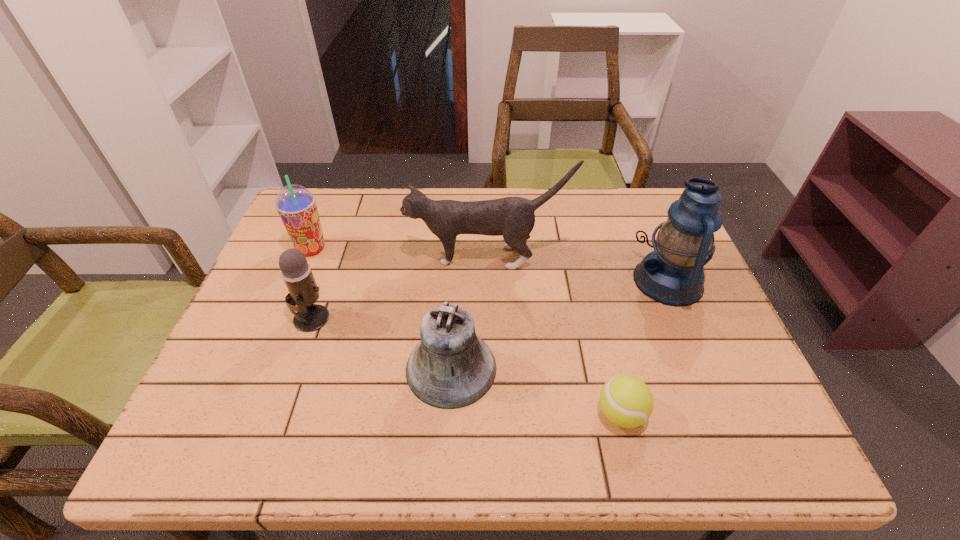
Where is `cat`? cat is located at coordinates (513, 218).

Where is `lantern`? Image resolution: width=960 pixels, height=540 pixels. lantern is located at coordinates (672, 274).

Identify the location of smoothie. (296, 205).

At what (x,y) coordinates should I click in order to perform the action: click on microphone. Please return your answer as a coordinate pair (x, y). Image resolution: width=960 pixels, height=540 pixels. Looking at the image, I should click on (303, 291).

Find the location of a particular element. This screenshot has width=960, height=540. bell is located at coordinates (450, 368).

Identify the location of the shortest object. (625, 400).

Locate an element on the screen. vacant space located at the face of the cat is located at coordinates (285, 258).

At what (x,y) coordinates should I click in order to perform the action: click on blank area located at the face of the cat. Please return your answer as a coordinate pair (x, y). This screenshot has width=960, height=540. Looking at the image, I should click on (351, 258).

At what (x,y) coordinates should I click in order to perform the action: click on vacant area situated 0.050m at the face of the cat. Please return your answer as a coordinate pair (x, y). The height and width of the screenshot is (540, 960). Looking at the image, I should click on (389, 258).

At what (x,y) coordinates should I click in order to perform the action: click on vacant space located 0.070m on the face of the rightmost object. Please return your answer as a coordinate pair (x, y). Looking at the image, I should click on (607, 281).